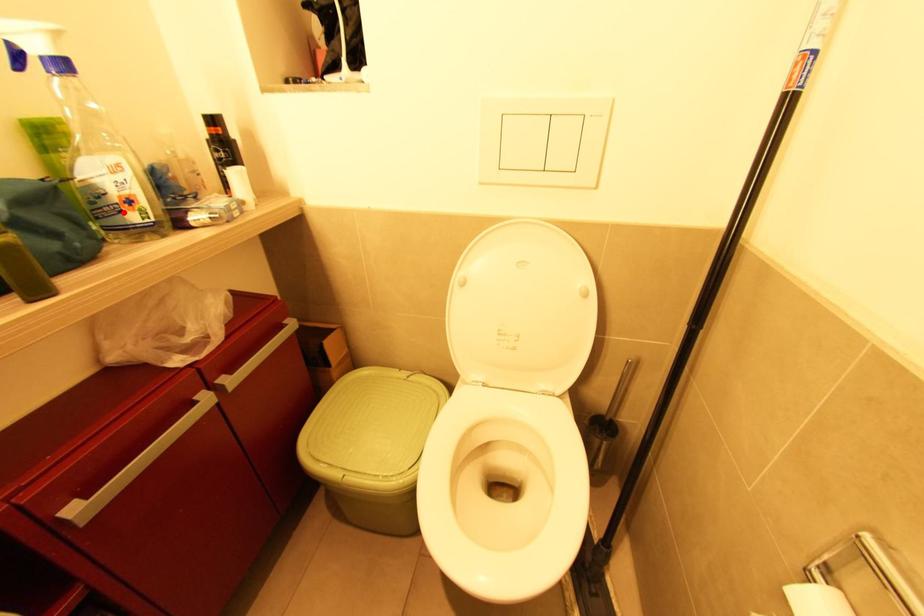
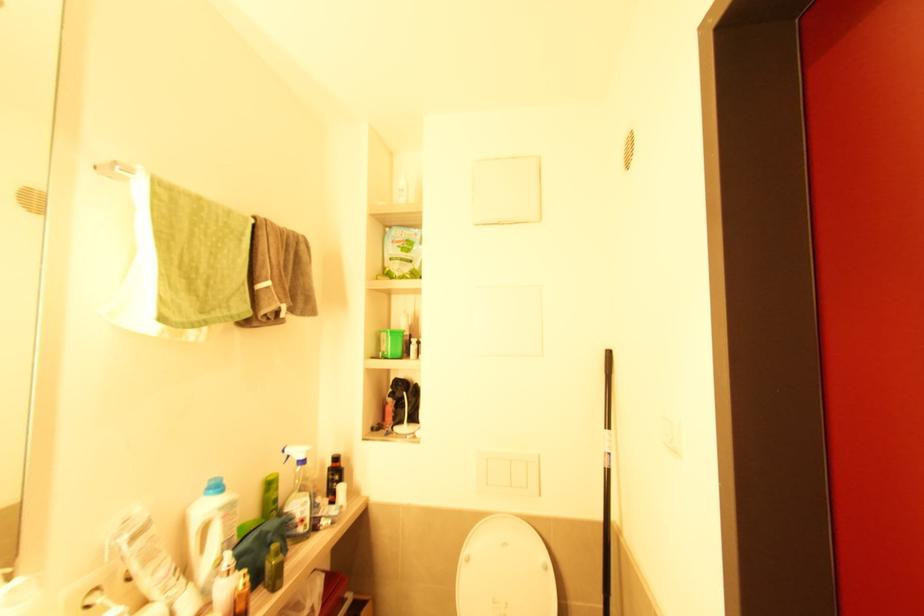
In the second image, find the point that corresponds to the highlighted location in the first image.

(298, 527)